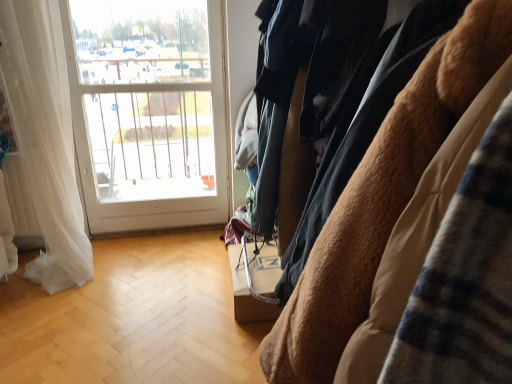
This screenshot has height=384, width=512. Identify the location of free space between white glass window at upper left and white sheer curtain at left. (150, 245).